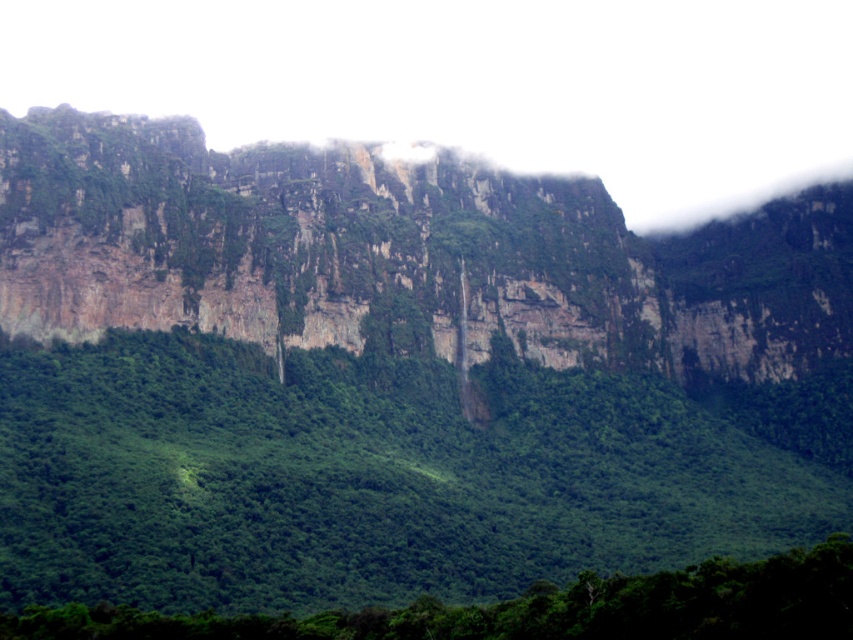
Question: Which of these objects is positioned closest to the green leafy vegetation at center?

Choices:
 (A) green leafy forest at lower center
 (B) rugged stone cliff at upper center

Answer: (B)

Question: Does green leafy vegetation at center have a lesser width compared to rugged stone cliff at upper center?

Choices:
 (A) yes
 (B) no

Answer: (A)

Question: Is rugged stone cliff at upper center bigger than green leafy forest at lower center?

Choices:
 (A) no
 (B) yes

Answer: (B)

Question: Which point is farther from the camera taking this photo?

Choices:
 (A) (477, 611)
 (B) (128, 316)
 (C) (86, 428)

Answer: (B)

Question: Considering the real-world distances, which object is closest to the green leafy forest at lower center?

Choices:
 (A) green leafy vegetation at center
 (B) rugged stone cliff at upper center

Answer: (A)

Question: Where is green leafy vegetation at center located in relation to rugged stone cliff at upper center in the image?

Choices:
 (A) left
 (B) right

Answer: (B)